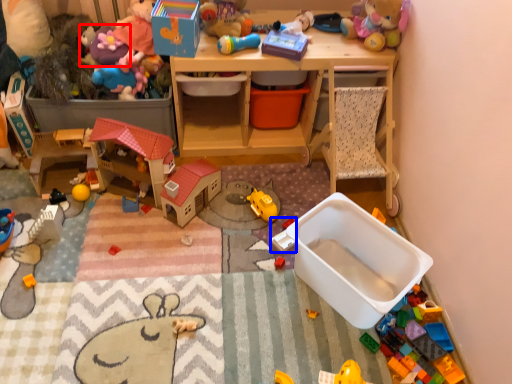
Question: Among these objects, which one is farthest to the camera, toy (highlighted by a red box) or toy (highlighted by a blue box)?

Choices:
 (A) toy
 (B) toy

Answer: (A)